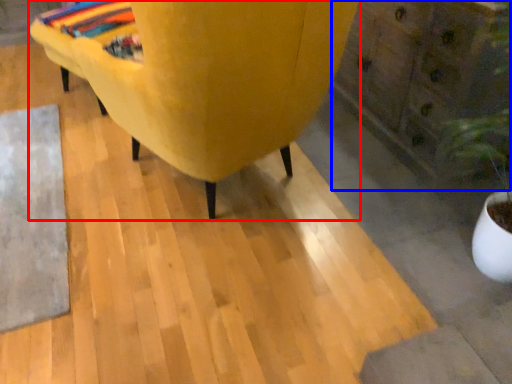
Question: Which of the following is the closest to the observer, furniture (highlighted by a red box) or dresser (highlighted by a blue box)?

Choices:
 (A) furniture
 (B) dresser

Answer: (A)